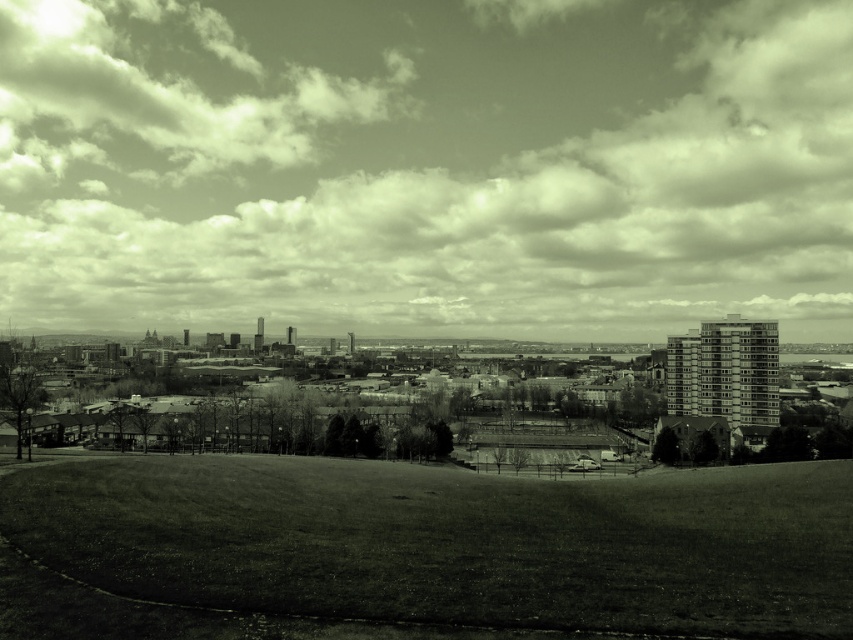
Is point (28, 328) positioned behind point (93, 536)?

That is True.

In order to click on cloudy sky at upper center in this screenshot , I will do `click(425, 166)`.